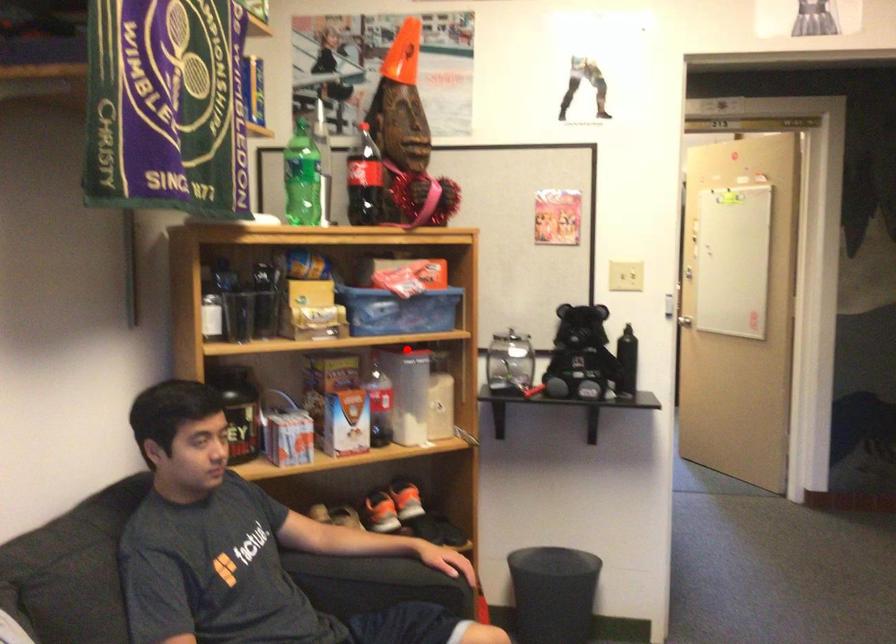
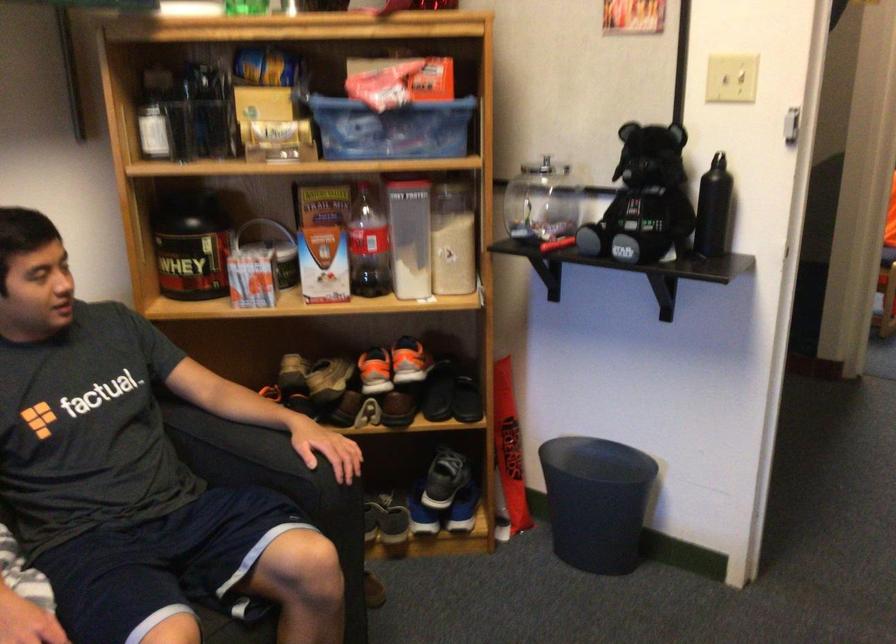
Question: I am providing you with two images of the same scene from different viewpoints. A red point is shown in image1. For the corresponding object point in image2, is it positioned nearer or farther from the camera?

Choices:
 (A) Nearer
 (B) Farther

Answer: (A)